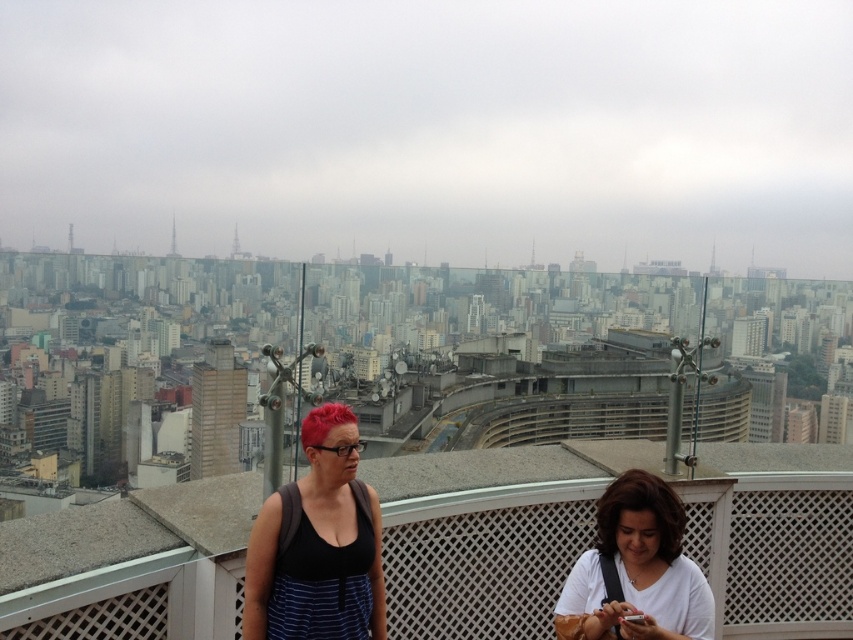
Which is behind, point (763, 628) or point (616, 548)?

Positioned behind is point (763, 628).

Between white lattice balcony at center and brown smooth hair at lower center, which one is positioned higher?

Positioned higher is brown smooth hair at lower center.

Between point (86, 621) and point (666, 522), which one is positioned behind?

Positioned behind is point (666, 522).

Image resolution: width=853 pixels, height=640 pixels. Find the location of `white lattice balcony at center`. white lattice balcony at center is located at coordinates pos(483,557).

Is brown smooth hair at lower center shorter than vivid red hair at center?

Yes.

Does brown smooth hair at lower center have a greater width compared to vivid red hair at center?

In fact, brown smooth hair at lower center might be narrower than vivid red hair at center.

Where is `brown smooth hair at lower center`? brown smooth hair at lower center is located at coordinates (639, 509).

Image resolution: width=853 pixels, height=640 pixels. Find the location of `brown smooth hair at lower center`. brown smooth hair at lower center is located at coordinates (639, 509).

Is white lattice balcony at center closer to camera compared to vivid red hair at center?

Yes, it is.

Between point (469, 499) and point (334, 424), which one is positioned behind?

Positioned behind is point (469, 499).

Identify the location of white lattice balcony at center. This screenshot has height=640, width=853. (483, 557).